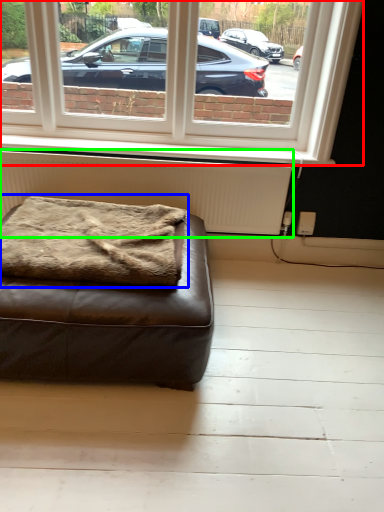
Question: Which object is the farthest from window (highlighted by a red box)? Choose among these: blanket (highlighted by a blue box) or radiator (highlighted by a green box).

Choices:
 (A) blanket
 (B) radiator

Answer: (A)